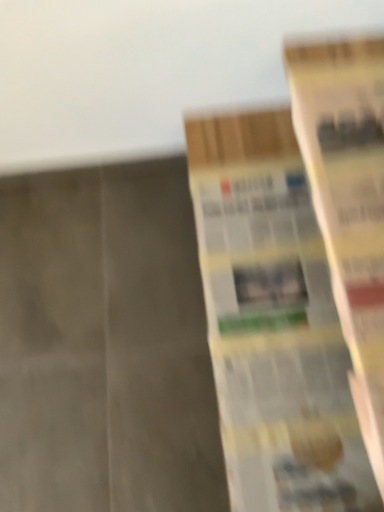
Describe the element at coordinates (348, 201) in the screenshot. This screenshot has height=512, width=384. I see `yellow paper book at right, the 1th book when ordered from right to left` at that location.

You are a GUI agent. You are given a task and a screenshot of the screen. Output one action in this format:
    pyautogui.click(x=<x>, y=<y>)
    Task: Click on the yellow paper book at right, the 1th book when ordered from right to left
    
    Given the screenshot: What is the action you would take?
    pyautogui.click(x=348, y=201)

Describe the element at coordinates (273, 322) in the screenshot. I see `yellow paper book at right, which is the second book in right-to-left order` at that location.

Where is `yellow paper book at right, which is the second book in right-to-left order`? The height and width of the screenshot is (512, 384). yellow paper book at right, which is the second book in right-to-left order is located at coordinates (273, 322).

Locate an element on the screen. The image size is (384, 512). yellow paper book at right, which ranks as the second book in left-to-right order is located at coordinates (348, 201).

Considering the positions of objects yellow paper book at right, which ranks as the second book in left-to-right order, and yellow paper book at right, which is the second book in right-to-left order, in the image provided, who is more to the right, yellow paper book at right, which ranks as the second book in left-to-right order, or yellow paper book at right, which is the second book in right-to-left order,?

yellow paper book at right, which ranks as the second book in left-to-right order, is more to the right.

Is yellow paper book at right, which ranks as the second book in left-to-right order, behind yellow paper book at right, which is the second book in right-to-left order?

That is False.

Which is closer to the camera, (311,126) or (276,117)?

Positioned in front is point (311,126).

From the image's perspective, relative to yellow paper book at right, placed as the 1th book when sorted from left to right, is yellow paper book at right, which ranks as the second book in left-to-right order, above or below?

yellow paper book at right, which ranks as the second book in left-to-right order, is above yellow paper book at right, placed as the 1th book when sorted from left to right.

From a real-world perspective, is yellow paper book at right, which ranks as the second book in left-to-right order, above or below yellow paper book at right, placed as the 1th book when sorted from left to right?

From a real-world perspective, yellow paper book at right, which ranks as the second book in left-to-right order, is physically above yellow paper book at right, placed as the 1th book when sorted from left to right.

Between yellow paper book at right, the 1th book when ordered from right to left, and yellow paper book at right, which is the second book in right-to-left order, which one has larger width?

With larger width is yellow paper book at right, which is the second book in right-to-left order.

Does yellow paper book at right, which ranks as the second book in left-to-right order, have a lesser height compared to yellow paper book at right, which is the second book in right-to-left order?

Yes.

Who is smaller, yellow paper book at right, which ranks as the second book in left-to-right order, or yellow paper book at right, placed as the 1th book when sorted from left to right?

yellow paper book at right, which ranks as the second book in left-to-right order, is smaller.

Would you say yellow paper book at right, which ranks as the second book in left-to-right order, is inside or outside yellow paper book at right, placed as the 1th book when sorted from left to right?

yellow paper book at right, which ranks as the second book in left-to-right order, exists outside the volume of yellow paper book at right, placed as the 1th book when sorted from left to right.

Is yellow paper book at right, the 1th book when ordered from right to left, in contact with yellow paper book at right, which is the second book in right-to-left order?

yellow paper book at right, the 1th book when ordered from right to left, and yellow paper book at right, which is the second book in right-to-left order, are clearly separated.

From the picture: Is yellow paper book at right, which ranks as the second book in left-to-right order, oriented away from yellow paper book at right, placed as the 1th book when sorted from left to right?

No.

How different are the orientations of yellow paper book at right, the 1th book when ordered from right to left, and yellow paper book at right, placed as the 1th book when sorted from left to right, in degrees?

yellow paper book at right, the 1th book when ordered from right to left, and yellow paper book at right, placed as the 1th book when sorted from left to right, are facing 0.00201 degrees away from each other.

Could you measure the distance between yellow paper book at right, the 1th book when ordered from right to left, and yellow paper book at right, placed as the 1th book when sorted from left to right?

yellow paper book at right, the 1th book when ordered from right to left, and yellow paper book at right, placed as the 1th book when sorted from left to right, are 8.20 inches apart.

The width and height of the screenshot is (384, 512). Identify the location of book behind the yellow paper book at right, which ranks as the second book in left-to-right order. click(x=273, y=322).

Is yellow paper book at right, placed as the 1th book when sorted from left to right, to the right of yellow paper book at right, the 1th book when ordered from right to left, from the viewer's perspective?

No.

Does yellow paper book at right, placed as the 1th book when sorted from left to right, come behind yellow paper book at right, which ranks as the second book in left-to-right order?

Yes, it is.

Which is farther from the camera, (220, 325) or (312, 131)?

The point (220, 325) is farther from the camera.

From the image's perspective, is yellow paper book at right, placed as the 1th book when sorted from left to right, located above or below yellow paper book at right, which ranks as the second book in left-to-right order?

Clearly, from the image's perspective, yellow paper book at right, placed as the 1th book when sorted from left to right, is below yellow paper book at right, which ranks as the second book in left-to-right order.

From a real-world perspective, is yellow paper book at right, placed as the 1th book when sorted from left to right, above or below yellow paper book at right, which ranks as the second book in left-to-right order?

In terms of real-world spatial position, yellow paper book at right, placed as the 1th book when sorted from left to right, is below yellow paper book at right, which ranks as the second book in left-to-right order.

Looking at this image, does yellow paper book at right, placed as the 1th book when sorted from left to right, have a greater width compared to yellow paper book at right, which ranks as the second book in left-to-right order?

Yes, yellow paper book at right, placed as the 1th book when sorted from left to right, is wider than yellow paper book at right, which ranks as the second book in left-to-right order.

Does yellow paper book at right, placed as the 1th book when sorted from left to right, have a lesser height compared to yellow paper book at right, which ranks as the second book in left-to-right order?

In fact, yellow paper book at right, placed as the 1th book when sorted from left to right, may be taller than yellow paper book at right, which ranks as the second book in left-to-right order.

Is yellow paper book at right, which is the second book in right-to-left order, bigger than yellow paper book at right, the 1th book when ordered from right to left?

Yes, yellow paper book at right, which is the second book in right-to-left order, is bigger than yellow paper book at right, the 1th book when ordered from right to left.

Could yellow paper book at right, which ranks as the second book in left-to-right order, be considered to be inside yellow paper book at right, placed as the 1th book when sorted from left to right?

No, yellow paper book at right, which ranks as the second book in left-to-right order, is not surrounded by yellow paper book at right, placed as the 1th book when sorted from left to right.

Is yellow paper book at right, which is the second book in right-to-left order, next to yellow paper book at right, the 1th book when ordered from right to left?

No, yellow paper book at right, which is the second book in right-to-left order, is not making contact with yellow paper book at right, the 1th book when ordered from right to left.

Is yellow paper book at right, which is the second book in right-to-left order, facing away from yellow paper book at right, the 1th book when ordered from right to left?

No, yellow paper book at right, which is the second book in right-to-left order, is not facing away from yellow paper book at right, the 1th book when ordered from right to left.

Can you tell me how much yellow paper book at right, placed as the 1th book when sorted from left to right, and yellow paper book at right, which ranks as the second book in left-to-right order, differ in facing direction?

They differ by 0.00201 degrees in their facing directions.

The image size is (384, 512). Find the location of `book behind the yellow paper book at right, the 1th book when ordered from right to left`. book behind the yellow paper book at right, the 1th book when ordered from right to left is located at coordinates (x=273, y=322).

Locate an element on the screen. book below the yellow paper book at right, which ranks as the second book in left-to-right order (from a real-world perspective) is located at coordinates (273, 322).

The height and width of the screenshot is (512, 384). In order to click on book above the yellow paper book at right, placed as the 1th book when sorted from left to right (from a real-world perspective) in this screenshot , I will do `click(348, 201)`.